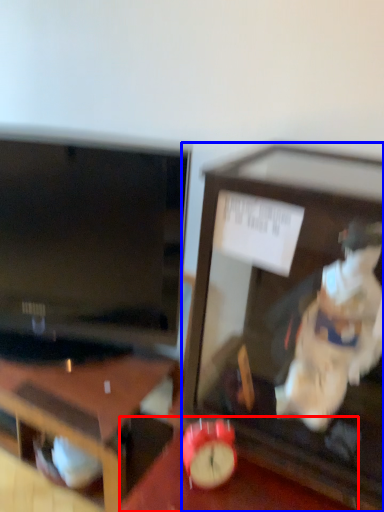
Question: Among these objects, which one is nearest to the camera, table (highlighted by a red box) or furniture (highlighted by a blue box)?

Choices:
 (A) table
 (B) furniture

Answer: (B)